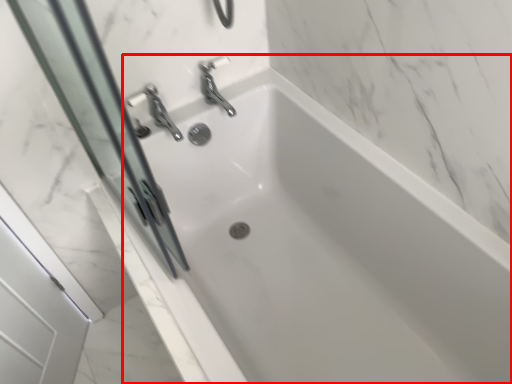
Question: In this image, where is bathtub (annotated by the red box) located relative to screen door?

Choices:
 (A) right
 (B) left

Answer: (A)